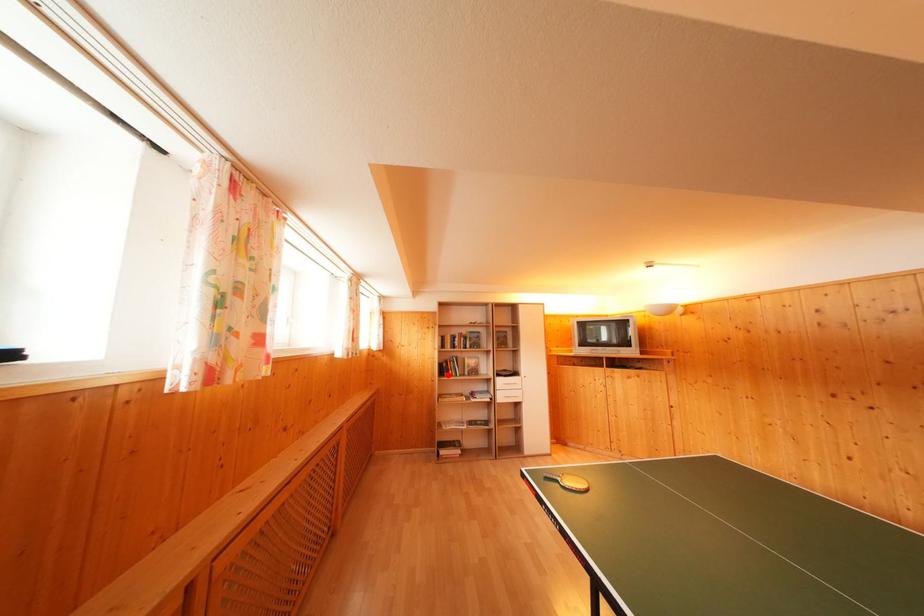
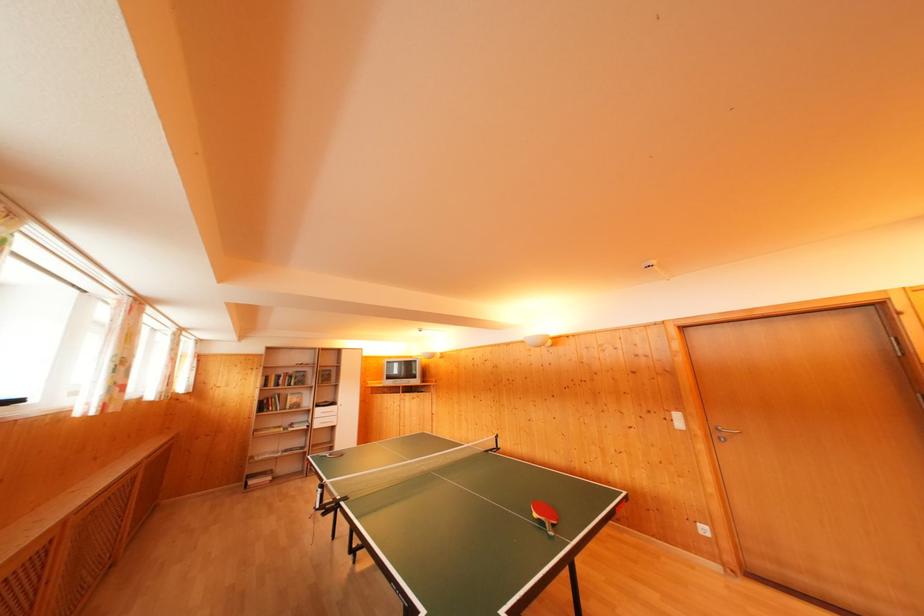
Locate, in the second image, the point that corresponds to the highlighted location in the first image.

(268, 411)